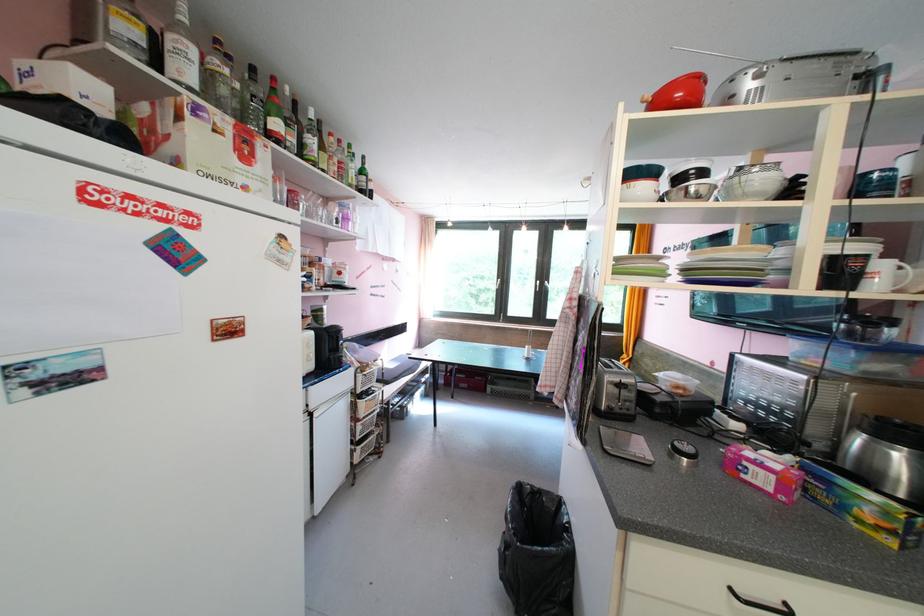
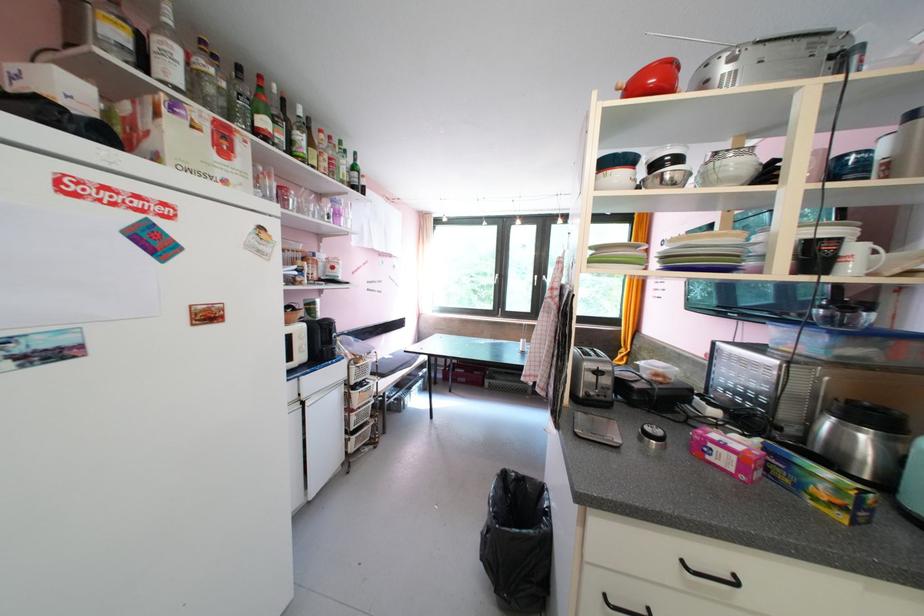
Find the pixel in the second image that matches pixel 210 63 in the first image.

(196, 65)